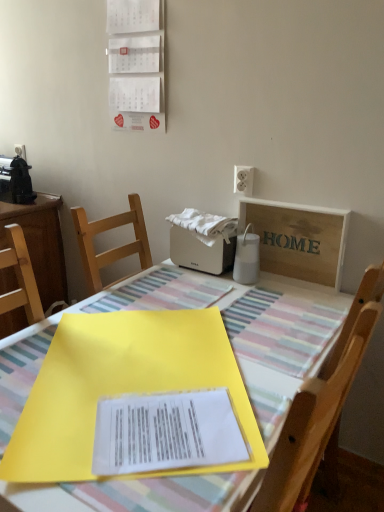
Where is `empty space that is ontop of wooden sign at upper right`? Image resolution: width=384 pixels, height=512 pixels. empty space that is ontop of wooden sign at upper right is located at coordinates (295, 202).